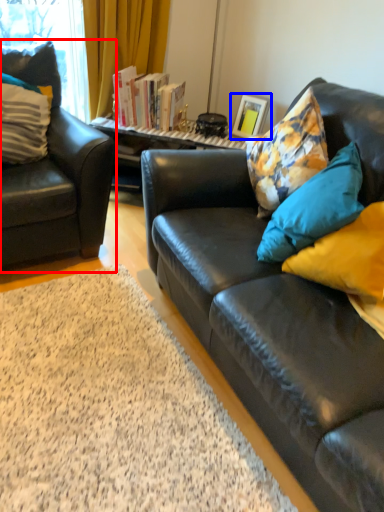
Question: Among these objects, which one is nearest to the camera, chair (highlighted by a red box) or picture frame (highlighted by a blue box)?

Choices:
 (A) chair
 (B) picture frame

Answer: (A)